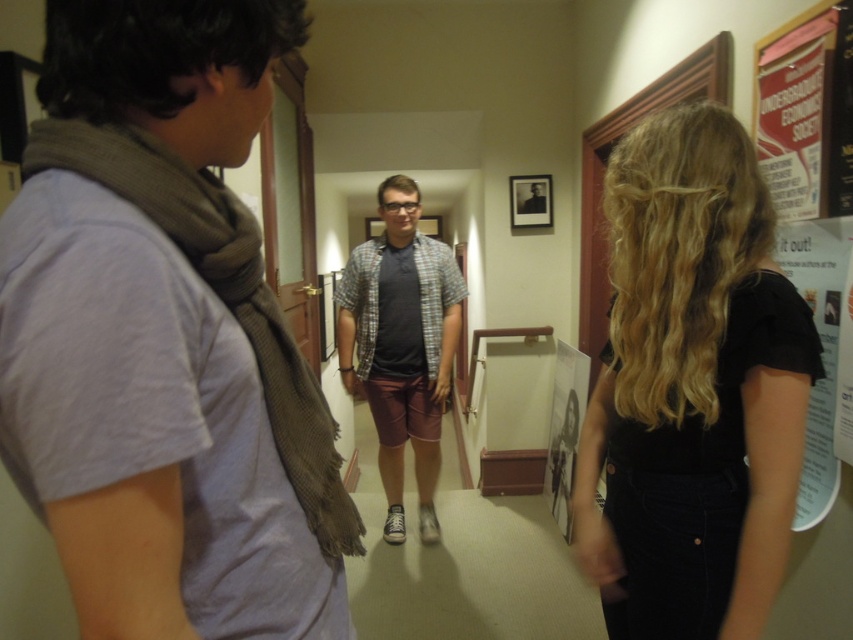
Looking at this image, you are standing in the hallway and want to move from the point at coordinates point (x=292, y=380) to the point at coordinates point (x=444, y=404). Which direction should you move in to get there?

To move from point (x=292, y=380) to point (x=444, y=404), you should move downward and to the right since the second point is located below and to the right of the first point.

You are standing in the hallway and see the black velvet shirt at center and the plaid shirt at center. Which one is positioned to the right?

The black velvet shirt at center is to the right of the plaid shirt at center.

You are standing in the hallway and notice two people wearing the black velvet shirt at center and the plaid shirt at center. Which of these two shirts is shorter in height?

The black velvet shirt at center is shorter in height compared to the plaid shirt at center.